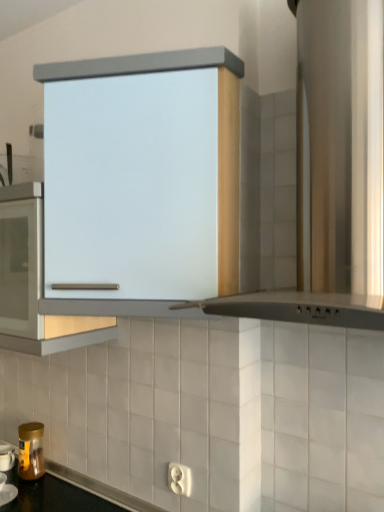
Question: Based on their sizes in the image, would you say satin silver hood at upper center is bigger or smaller than satin white cabinet at center?

Choices:
 (A) small
 (B) big

Answer: (B)

Question: Is satin silver hood at upper center to the left or to the right of satin white cabinet at center in the image?

Choices:
 (A) right
 (B) left

Answer: (A)

Question: Which is farther from the gold metallic jar at lower left?

Choices:
 (A) satin silver hood at upper center
 (B) satin white cabinet at center

Answer: (A)

Question: Which object is positioned farthest from the gold metallic jar at lower left?

Choices:
 (A) satin silver hood at upper center
 (B) satin white cabinet at center

Answer: (A)